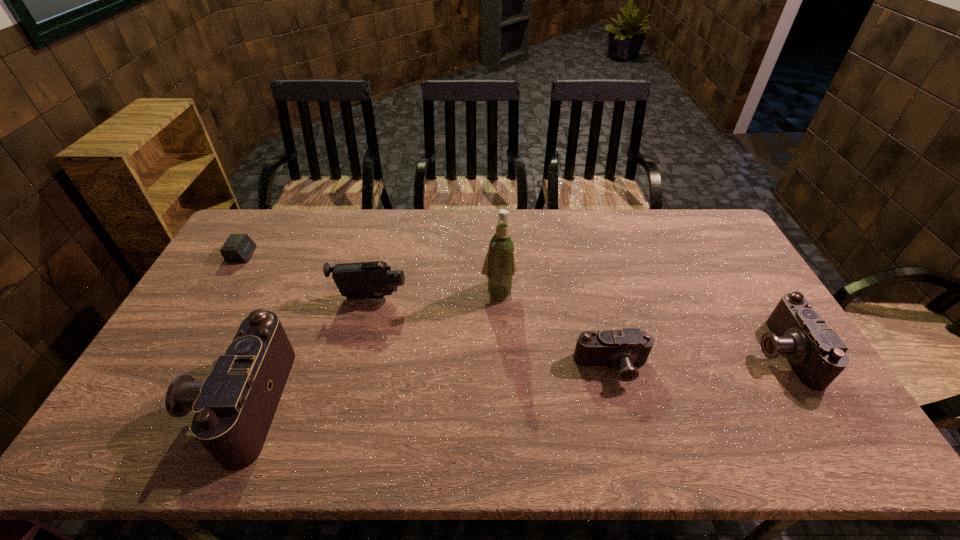
Locate an element on the screen. vacant space at the far right corner of the desktop is located at coordinates (711, 231).

I want to click on empty location between the leftmost object and the rightmost camera, so click(x=512, y=303).

The image size is (960, 540). I want to click on free space that is in between the wine bottle and the second shortest camera, so click(640, 322).

Find the location of a particular element. The image size is (960, 540). vacant space that's between the third object from left to right and the tallest object is located at coordinates (435, 295).

At what (x,y) coordinates should I click in order to perform the action: click on free space between the rightmost camera and the second camera from left to right. Please return your answer as a coordinate pair (x, y). Looking at the image, I should click on (697, 360).

The width and height of the screenshot is (960, 540). Find the location of `free space between the rightmost object and the second camera from right to left`. free space between the rightmost object and the second camera from right to left is located at coordinates (697, 360).

Identify the location of vacant area between the camcorder and the fifth tallest object. (492, 333).

Locate an element on the screen. vacant space in between the fifth shortest object and the fourth object from left to right is located at coordinates (370, 347).

Locate an element on the screen. The image size is (960, 540). free spot between the second shortest camera and the camcorder is located at coordinates (576, 325).

Locate which object ranks fourth in proximity to the second camera from left to right. Please provide its 2D coordinates. Your answer should be formatted as a tuple, i.e. [(x, y)], where the tuple contains the x and y coordinates of a point satisfying the conditions above.

[(234, 407)]